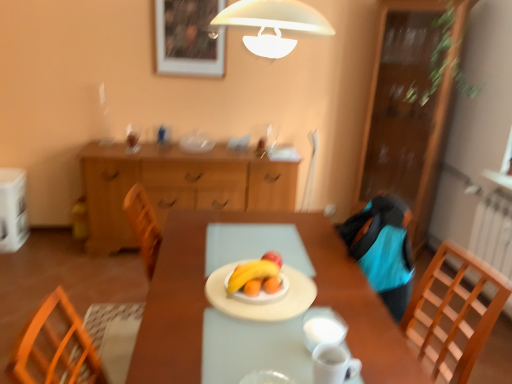
Question: Is yellow matte banana at center further to camera compared to white fabric armchair at upper center?

Choices:
 (A) yes
 (B) no

Answer: (B)

Question: Is yellow matte banana at center taller than white fabric armchair at upper center?

Choices:
 (A) no
 (B) yes

Answer: (A)

Question: Is yellow matte banana at center facing towards white fabric armchair at upper center?

Choices:
 (A) no
 (B) yes

Answer: (A)

Question: Considering the relative sizes of yellow matte banana at center and white fabric armchair at upper center in the image provided, is yellow matte banana at center shorter than white fabric armchair at upper center?

Choices:
 (A) no
 (B) yes

Answer: (B)

Question: Can you confirm if yellow matte banana at center is thinner than white fabric armchair at upper center?

Choices:
 (A) yes
 (B) no

Answer: (A)

Question: From the image's perspective, is wooden table at center above or below white matte plate at center, positioned as the 1th tableware in back-to-front order?

Choices:
 (A) above
 (B) below

Answer: (B)

Question: From a real-world perspective, is wooden table at center physically located above or below white matte plate at center, positioned as the 1th tableware in back-to-front order?

Choices:
 (A) above
 (B) below

Answer: (B)

Question: In the image, is wooden table at center positioned in front of or behind white matte plate at center, which is the fourth tableware in front-to-back order?

Choices:
 (A) front
 (B) behind

Answer: (A)

Question: In terms of height, does wooden table at center look taller or shorter compared to white matte plate at center, which is the fourth tableware in front-to-back order?

Choices:
 (A) short
 (B) tall

Answer: (B)

Question: In terms of height, does wooden cabinet at right, acting as the 2th cabinetry starting from the left, look taller or shorter compared to white glossy mug at center, which is counted as the second tableware, starting from the back?

Choices:
 (A) short
 (B) tall

Answer: (B)

Question: From a real-world perspective, relative to white glossy mug at center, which ranks as the 3th tableware in front-to-back order, is wooden cabinet at right, which is the 1th cabinetry from right to left, vertically above or below?

Choices:
 (A) above
 (B) below

Answer: (A)

Question: Looking at the image, does wooden cabinet at right, which is the 1th cabinetry from right to left, seem bigger or smaller compared to white glossy mug at center, which ranks as the 3th tableware in front-to-back order?

Choices:
 (A) small
 (B) big

Answer: (B)

Question: Is point (380, 168) closer or farther from the camera than point (307, 322)?

Choices:
 (A) farther
 (B) closer

Answer: (A)

Question: Is white glossy mug at lower center, the 3th tableware viewed from the back, to the left or to the right of white glossy mug at center, which is counted as the second tableware, starting from the back, in the image?

Choices:
 (A) right
 (B) left

Answer: (B)

Question: In terms of size, does white glossy mug at lower center, which is the 2th tableware from front to back, appear bigger or smaller than white glossy mug at center, which ranks as the 3th tableware in front-to-back order?

Choices:
 (A) big
 (B) small

Answer: (A)